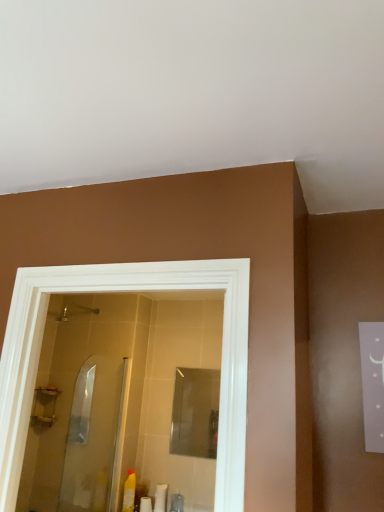
Question: Looking at their shapes, would you say translucent plastic bottle at lower center, the first toiletry from the right, is wider or thinner than clear glass shower door at center?

Choices:
 (A) thin
 (B) wide

Answer: (B)

Question: Considering the relative positions of translucent plastic bottle at lower center, which is the third toiletry in left-to-right order, and clear glass shower door at center in the image provided, is translucent plastic bottle at lower center, which is the third toiletry in left-to-right order, to the left or to the right of clear glass shower door at center?

Choices:
 (A) right
 (B) left

Answer: (A)

Question: Considering the real-world distances, which object is farthest from the clear glass shower door at center?

Choices:
 (A) brushed metal shower at upper left
 (B) yellow plastic bottle at lower left, which is the third toiletry from right to left
 (C) white matte tube at lower center, the 2th toiletry positioned from the left
 (D) translucent plastic bottle at lower center, which is the third toiletry in left-to-right order

Answer: (A)

Question: Based on their relative distances, which object is nearer to the white matte tube at lower center, the 2th toiletry positioned from the left?

Choices:
 (A) brushed metal shower at upper left
 (B) yellow plastic bottle at lower left, which is the first toiletry from left to right
 (C) translucent plastic bottle at lower center, the first toiletry from the right
 (D) clear glass shower door at center

Answer: (C)